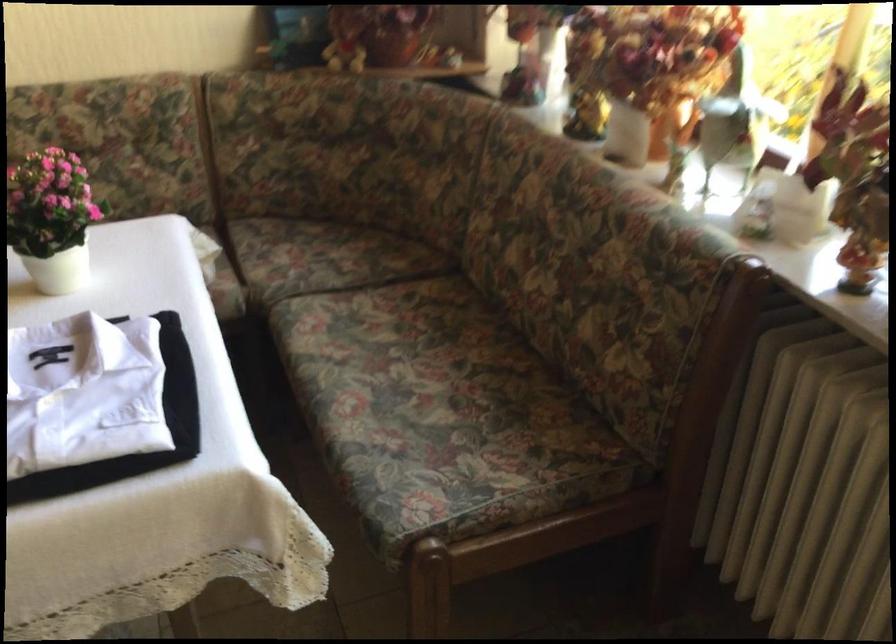
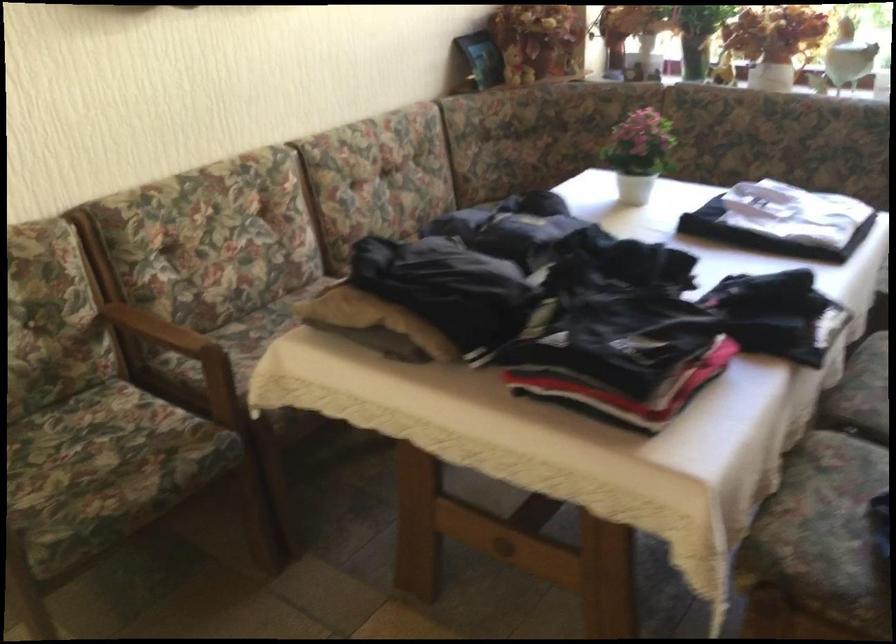
Question: I am providing you with two images of the same scene from different viewpoints. Please identify which objects are invisible in image2.

Choices:
 (A) wooden chair armrest
 (B) sofa sitting surface
 (C) floral sofa sitting surface
 (D) grey laundry hamper

Answer: (C)